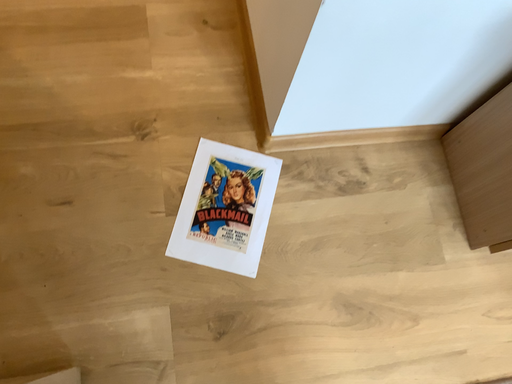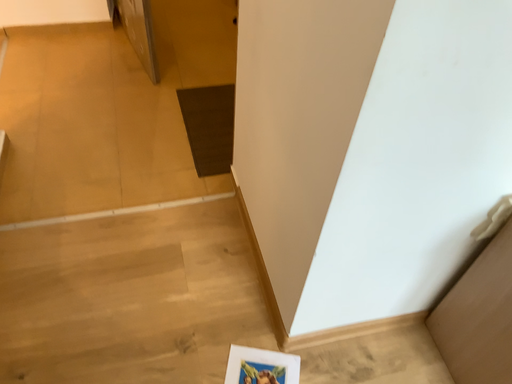
Question: Which way did the camera rotate in the video?

Choices:
 (A) rotated downward
 (B) rotated upward

Answer: (B)